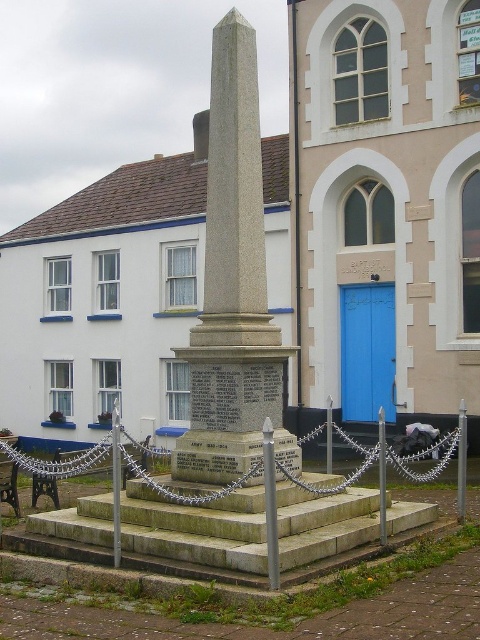
You are standing in front of the building and want to approach the granite obelisk at center. Which direction should you walk relative to the gray stone stairs at center?

The granite obelisk at center is to the left of the gray stone stairs at center, so you should walk to the left side of the gray stone stairs at center to reach it.

You are a tour guide explaining the memorial to visitors. You want to mention the relative sizes of the granite obelisk at center and the gray stone stairs at center. How would you describe their sizes in relation to each other?

The granite obelisk at center is taller than the gray stone stairs at center.

You are a visitor standing at the entrance of the building and want to approach the granite obelisk at center. There is a gray stone stairs at center between you and the obelisk. Can you walk directly to the obelisk without going around the stairs?

The granite obelisk at center and gray stone stairs at center are 4.96 feet apart. Since the stairs are between you and the obelisk, you can walk directly to the obelisk as the distance is manageable and the stairs are likely part of the path.